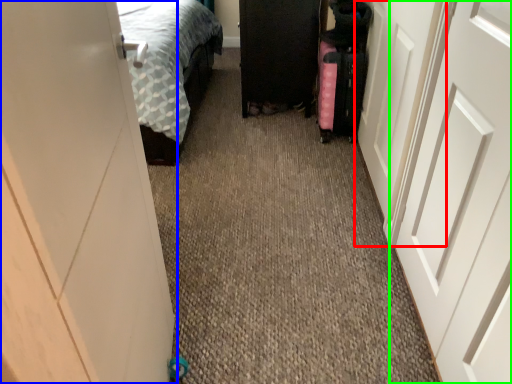
Question: Which object is the farthest from door (highlighted by a red box)? Choose among these: door (highlighted by a blue box) or door (highlighted by a green box).

Choices:
 (A) door
 (B) door

Answer: (A)